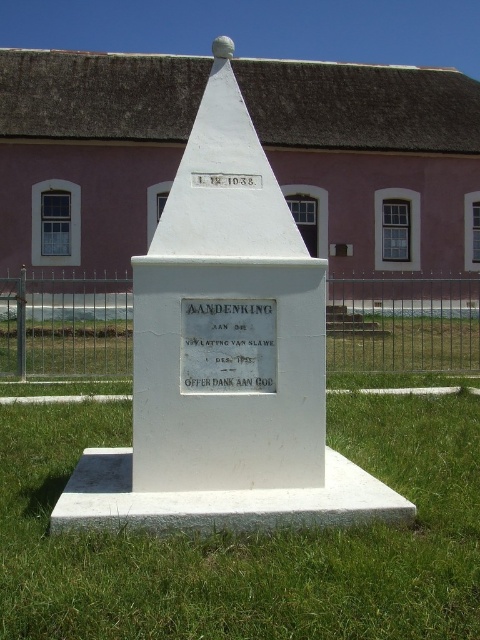
Is point (181, 280) positioned behind point (92, 360)?

No.

Who is higher up, white marble monument at center or metallic wire fence at center?

white marble monument at center is above.

This screenshot has height=640, width=480. What do you see at coordinates (227, 320) in the screenshot?
I see `white marble monument at center` at bounding box center [227, 320].

This screenshot has width=480, height=640. Find the location of `white marble monument at center`. white marble monument at center is located at coordinates (227, 320).

Which is more to the right, green grass at center or white polished stone plaque at center?

Positioned to the right is green grass at center.

Does green grass at center have a larger size compared to white polished stone plaque at center?

Correct, green grass at center is larger in size than white polished stone plaque at center.

The width and height of the screenshot is (480, 640). What are the coordinates of `green grass at center` in the screenshot? It's located at (250, 540).

Can you confirm if white marble monument at center is taller than white polished stone plaque at center?

Yes, white marble monument at center is taller than white polished stone plaque at center.

Which is in front, point (205, 371) or point (220, 368)?

Positioned in front is point (205, 371).

Looking at this image, measure the distance between point (261, 376) and camera.

A distance of 4.11 meters exists between point (261, 376) and camera.

You are a GUI agent. You are given a task and a screenshot of the screen. Output one action in this format:
    pyautogui.click(x=<x>, y=<y>)
    Task: Click on the white marble monument at center
    This screenshot has height=640, width=480.
    Given the screenshot: What is the action you would take?
    pyautogui.click(x=227, y=320)